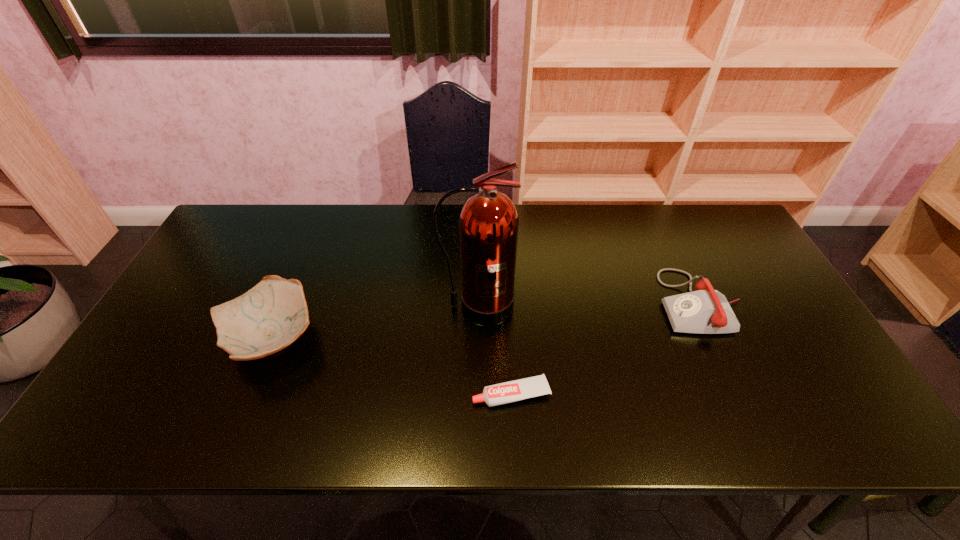
Where is `the tallest object`? The width and height of the screenshot is (960, 540). the tallest object is located at coordinates (488, 225).

This screenshot has width=960, height=540. Identify the location of the third shortest object. (269, 317).

Image resolution: width=960 pixels, height=540 pixels. What are the coordinates of `the leftmost object` in the screenshot? It's located at (269, 317).

The height and width of the screenshot is (540, 960). Identify the location of telephone. (705, 311).

Identify the location of the second shortest object. This screenshot has height=540, width=960. (705, 311).

At what (x,y) coordinates should I click in order to perform the action: click on toothpaste. Please return your answer as a coordinate pair (x, y). The height and width of the screenshot is (540, 960). Looking at the image, I should click on (512, 391).

You are a GUI agent. You are given a task and a screenshot of the screen. Output one action in this format:
    pyautogui.click(x=<x>, y=<y>)
    Task: Click on the blank space located 0.200m on the front-facing side of the fire extinguisher
    The image size is (960, 540).
    Given the screenshot: What is the action you would take?
    pyautogui.click(x=477, y=394)

Image resolution: width=960 pixels, height=540 pixels. I want to click on free spot located on the left of the pottery, so coord(190,339).

Where is `vacant space situated on the dial of the rightmost object`? The height and width of the screenshot is (540, 960). vacant space situated on the dial of the rightmost object is located at coordinates (625, 302).

Locate an element on the screen. This screenshot has height=540, width=960. vacant space located on the dial of the rightmost object is located at coordinates (519, 302).